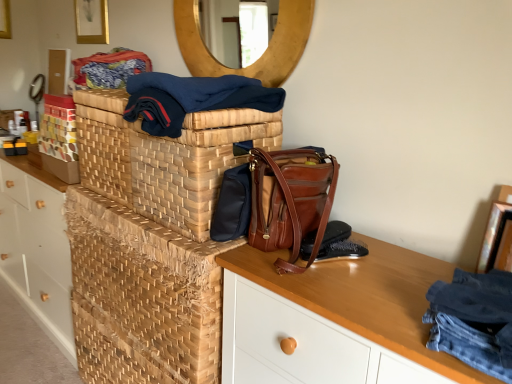
You are a GUI agent. You are given a task and a screenshot of the screen. Output one action in this format:
    pyautogui.click(x=<x>, y=<y>)
    Task: Click on the vacant area that is in front of black leather shoe at lower right, the second shoe in the bottom-to-top sequence
    This screenshot has width=512, height=384.
    Given the screenshot: What is the action you would take?
    pyautogui.click(x=343, y=286)